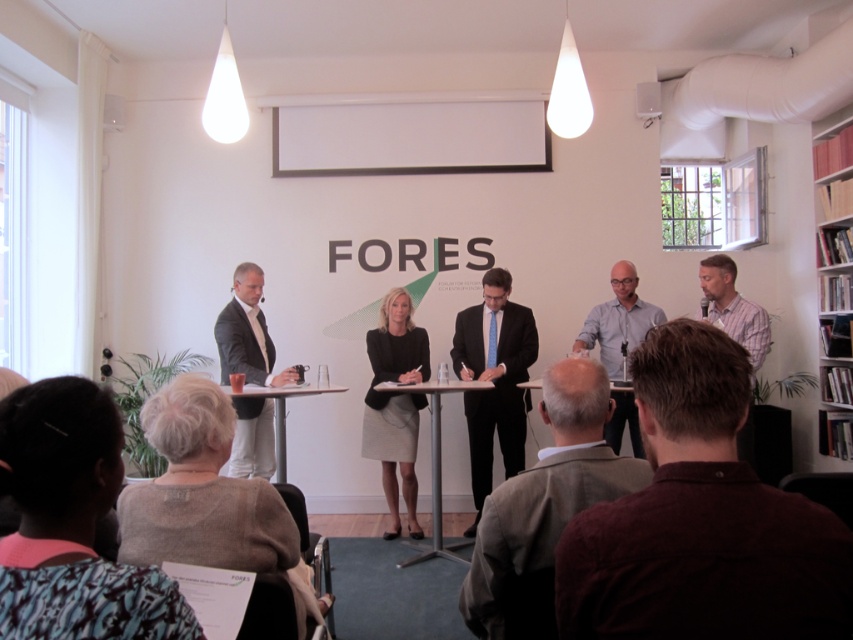
Which is above, black fabric skirt at center or metallic silver table at center?

Positioned higher is black fabric skirt at center.

Does point (409, 531) come behind point (431, 416)?

Yes, it is.

Which is behind, point (383, 326) or point (436, 396)?

Point (383, 326)

The image size is (853, 640). I want to click on black fabric skirt at center, so click(395, 403).

Does light gray suit at left appear on the left side of plaid cotton shirt at right?

Yes, light gray suit at left is to the left of plaid cotton shirt at right.

Which is behind, point (257, 266) or point (721, 269)?

Positioned behind is point (257, 266).

The height and width of the screenshot is (640, 853). Describe the element at coordinates (247, 332) in the screenshot. I see `light gray suit at left` at that location.

Identify the location of light gray suit at left. (247, 332).

Does light blue shirt at center lie behind white glossy table at center?

That is True.

Find the location of `light blue shirt at center`. light blue shirt at center is located at coordinates (618, 320).

Between point (611, 284) and point (231, 394), which one is positioned in front?

Point (231, 394)

Where is `light blue shirt at center`? The width and height of the screenshot is (853, 640). light blue shirt at center is located at coordinates (618, 320).